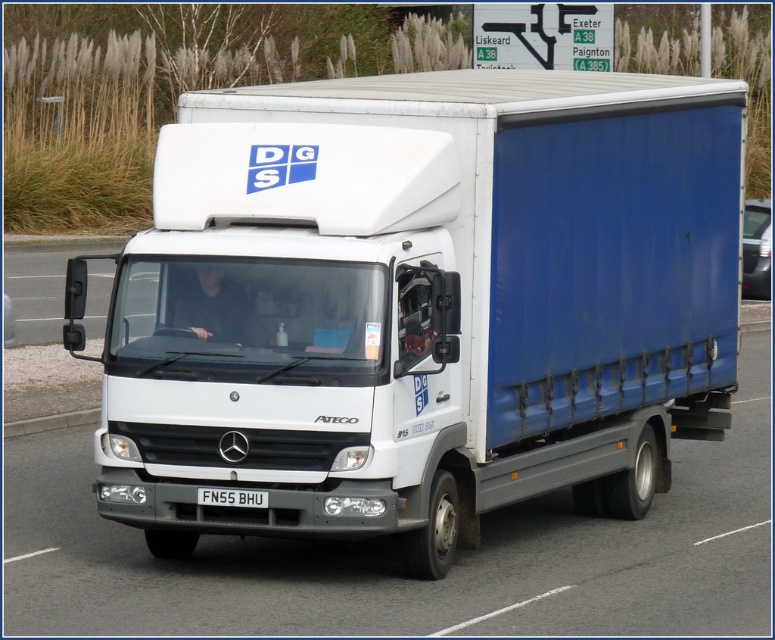
What are the coordinates of the white matte truck at center?

The white matte truck at center is located at point [422,304].

You are a traffic officer observing a vehicle. You see a white matte truck at center and a black metal license plate at center. Which object is positioned to the right side?

The white matte truck at center is positioned to the right of the black metal license plate at center.

You are a delivery driver who needs to attach a GPS tracker to your truck. The GPS tracker requires a minimum of 2 meters of space between the device and any metal objects to function properly. Given the distance between the white matte truck at center and the black metal license plate at center, can the GPS tracker be placed on the truck without interference?

The white matte truck at center and the black metal license plate at center are 1.84 meters apart. Since the required minimum distance is 2 meters, the GPS tracker cannot be placed on the truck without interference as the distance is insufficient.